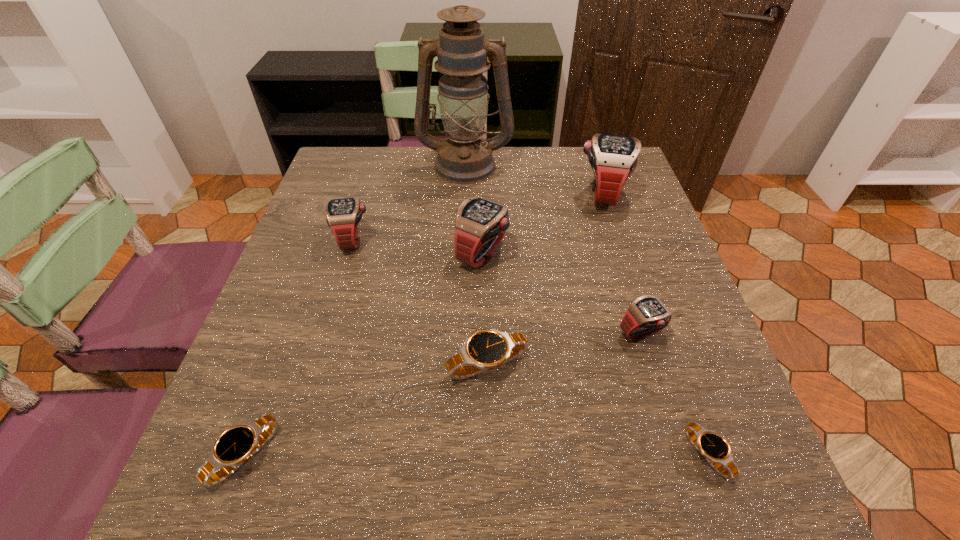
The image size is (960, 540). Find the location of `vacant point located between the shortest watch and the tallest object`. vacant point located between the shortest watch and the tallest object is located at coordinates (586, 309).

What are the coordinates of `free area in between the second tallest object and the second black watch from right to left` in the screenshot? It's located at (544, 279).

Locate which object is the third closest to the farthest watch. Please provide its 2D coordinates. Your answer should be formatted as a tuple, i.e. [(x, y)], where the tuple contains the x and y coordinates of a point satisfying the conditions above.

[(647, 315)]

Identify which object is located as the third nearest to the third red watch from right to left. Please provide its 2D coordinates. Your answer should be formatted as a tuple, i.e. [(x, y)], where the tuple contains the x and y coordinates of a point satisfying the conditions above.

[(464, 157)]

At what (x,y) coordinates should I click in order to perform the action: click on the fifth closest watch to the farthest red watch. Please return your answer as a coordinate pair (x, y). Image resolution: width=960 pixels, height=540 pixels. Looking at the image, I should click on (713, 447).

In order to click on watch that is the second closest to the biggest black watch in this screenshot , I will do `click(647, 315)`.

Locate an element on the screen. The width and height of the screenshot is (960, 540). the third closest red watch to the third shortest watch is located at coordinates (343, 215).

The image size is (960, 540). I want to click on red watch that is the third nearest to the farthest black watch, so click(x=343, y=215).

I want to click on black watch identified as the third closest to the leftmost red watch, so click(x=713, y=447).

Identify which black watch is the closest to the smallest black watch. Please provide its 2D coordinates. Your answer should be formatted as a tuple, i.e. [(x, y)], where the tuple contains the x and y coordinates of a point satisfying the conditions above.

[(485, 349)]